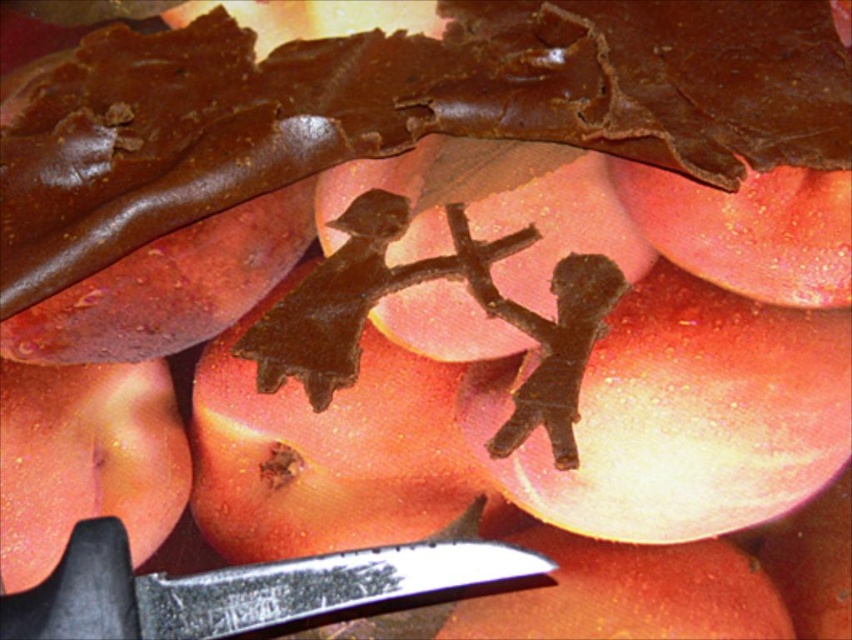
In the scene shown: You are a chocolate sculptor working on a new piece. You have a point marked at coordinates (331, 454). Where exactly is this point located in your chocolate sculpture?

The point is located on the smooth brown chocolate at center.

You are a food stylist arranging a dessert display. You have a smooth dark brown chocolate cake at center and a smooth brown chocolate at center. Which item is closer to the viewer in the image?

The smooth dark brown chocolate cake at center is closer to the viewer than the smooth brown chocolate at center.

You are taking a photo of the fruit arrangement and want to focus on both point (301,435) and point (150,529). Which point should you focus on first to ensure both are in sharp focus?

You should focus on point (301,435) first because it is closer to the camera than point (150,529). By focusing on the closer point, the depth of field may extend to include the farther point as well.